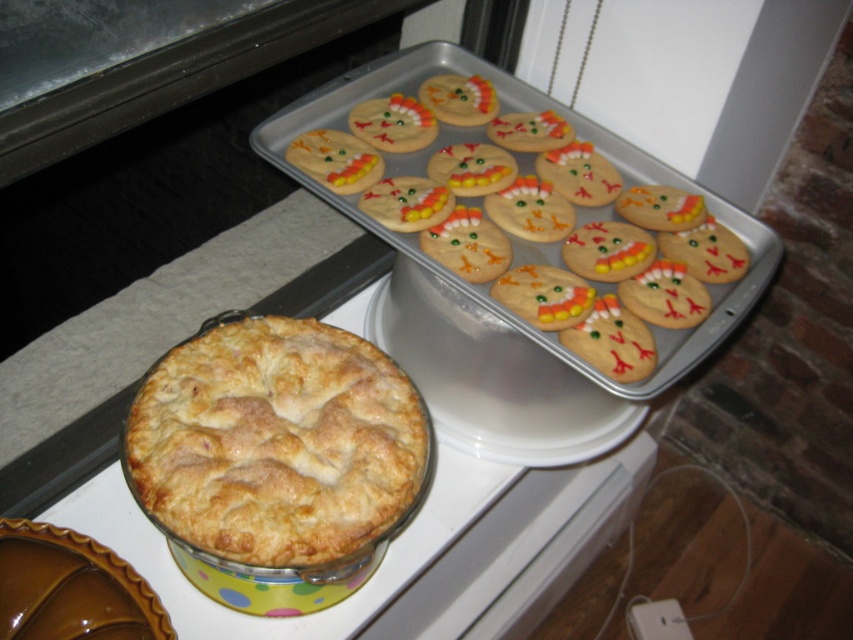
You are a guest at a baking competition and see the golden sugar cookies at upper right and the golden flaky pie at center. Which baked good is positioned higher on the table?

The golden sugar cookies at upper right are positioned higher on the table than the golden flaky pie at center because they are located above it.

You are planning to serve both the golden sugar cookies at upper right and the golden flaky pie at center to guests. If you want to arrange them on a rectangular platter that can only accommodate one large item and one smaller item, which item should go where?

The golden sugar cookies at upper right should be placed as the large item and the golden flaky pie at center as the smaller item since the golden sugar cookies at upper right is bigger than the golden flaky pie at center.